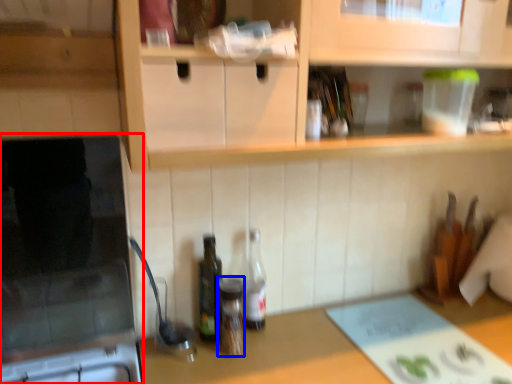
Question: Which object appears farthest to the camera in this image, appliance (highlighted by a red box) or bottle (highlighted by a blue box)?

Choices:
 (A) appliance
 (B) bottle

Answer: (B)